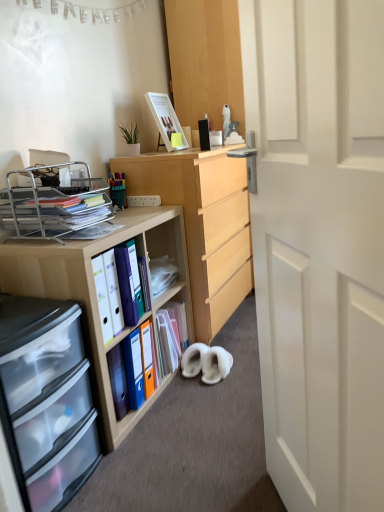
Question: Is matte plastic folder at center, marked as the second book in a front-to-back arrangement, bigger than matte plastic folders at center left, marked as the 2th book in a back-to-front arrangement?

Choices:
 (A) no
 (B) yes

Answer: (B)

Question: Is matte plastic folder at center, positioned as the first book in back-to-front order, with matte plastic folders at center left, marked as the 2th book in a back-to-front arrangement?

Choices:
 (A) no
 (B) yes

Answer: (A)

Question: From the image's perspective, is matte plastic folder at center, marked as the second book in a front-to-back arrangement, located beneath matte plastic folders at center left, the 1th book in the front-to-back sequence?

Choices:
 (A) yes
 (B) no

Answer: (A)

Question: Is matte plastic folder at center, positioned as the first book in back-to-front order, further to the viewer compared to matte plastic folders at center left, marked as the 2th book in a back-to-front arrangement?

Choices:
 (A) yes
 (B) no

Answer: (A)

Question: From the image's perspective, does matte plastic folder at center, marked as the second book in a front-to-back arrangement, appear higher than matte plastic folders at center left, the 1th book in the front-to-back sequence?

Choices:
 (A) yes
 (B) no

Answer: (B)

Question: Is matte plastic folder at center, positioned as the first book in back-to-front order, positioned far away from matte plastic folders at center left, the 1th book in the front-to-back sequence?

Choices:
 (A) no
 (B) yes

Answer: (A)

Question: From a real-world perspective, does metallic silver organizer at left sit lower than matte plastic folders at center left, the 1th book in the front-to-back sequence?

Choices:
 (A) yes
 (B) no

Answer: (B)

Question: Is metallic silver organizer at left smaller than matte plastic folders at center left, the 1th book in the front-to-back sequence?

Choices:
 (A) yes
 (B) no

Answer: (B)

Question: Is metallic silver organizer at left taller than matte plastic folders at center left, marked as the 2th book in a back-to-front arrangement?

Choices:
 (A) yes
 (B) no

Answer: (B)

Question: Can you confirm if metallic silver organizer at left is shorter than matte plastic folders at center left, marked as the 2th book in a back-to-front arrangement?

Choices:
 (A) yes
 (B) no

Answer: (A)

Question: Is metallic silver organizer at left to the left of matte plastic folders at center left, the 1th book in the front-to-back sequence, from the viewer's perspective?

Choices:
 (A) yes
 (B) no

Answer: (A)

Question: Considering the relative sizes of metallic silver organizer at left and matte plastic folders at center left, the 1th book in the front-to-back sequence, in the image provided, is metallic silver organizer at left thinner than matte plastic folders at center left, the 1th book in the front-to-back sequence,?

Choices:
 (A) no
 (B) yes

Answer: (A)

Question: Is metallic silver organizer at left taller than clear plastic drawers at lower left?

Choices:
 (A) yes
 (B) no

Answer: (B)